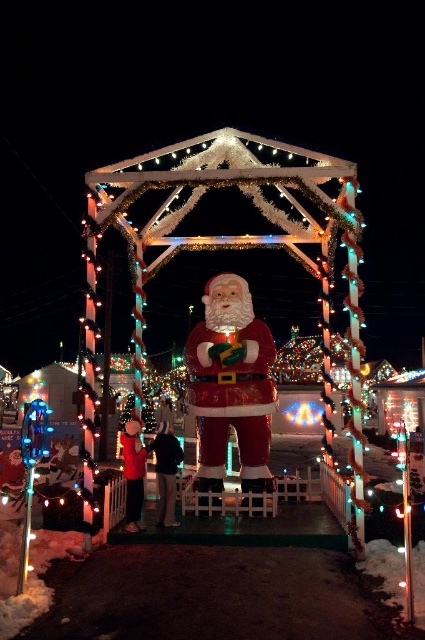
Question: Is shiny plastic santa at center above red glossy santa claus at center?

Choices:
 (A) yes
 (B) no

Answer: (A)

Question: Which of the following is the farthest from the observer?

Choices:
 (A) (201, 440)
 (B) (291, 230)

Answer: (B)

Question: Can you confirm if shiny plastic santa at center is positioned to the left of red glossy santa claus at center?

Choices:
 (A) no
 (B) yes

Answer: (B)

Question: Which object is farther from the camera taking this photo?

Choices:
 (A) red glossy santa claus at center
 (B) shiny plastic santa at center

Answer: (A)

Question: From the image, what is the correct spatial relationship of shiny plastic santa at center in relation to red glossy santa claus at center?

Choices:
 (A) below
 (B) above

Answer: (B)